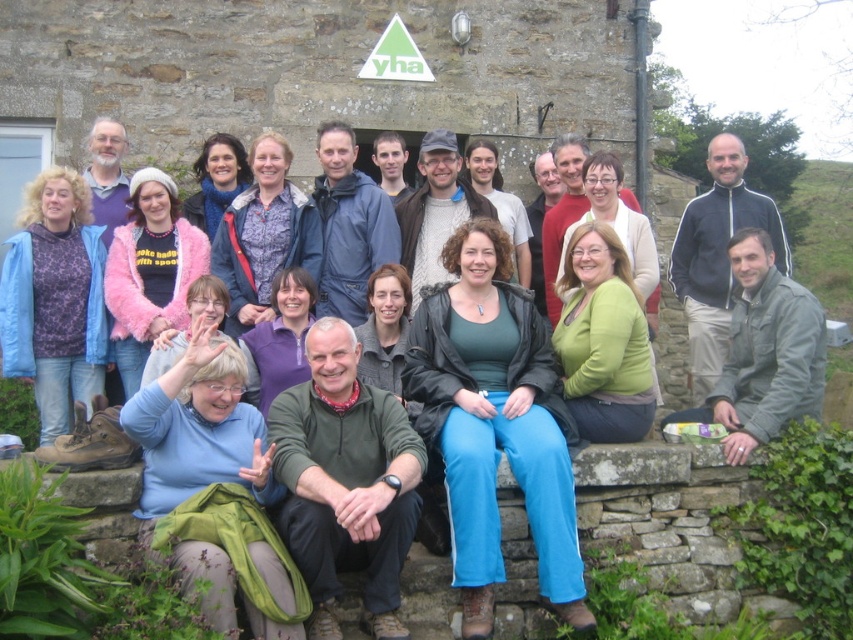
You are a photographer trying to capture a closeup of the green matte shirt at center and the knitted gray sweater at center. Which one is wider so that you can focus on it first?

The green matte shirt at center might be wider than knitted gray sweater at center, so you should focus on the green matte shirt at center first.

You are a photographer trying to focus on the matte blue scarf at center. However, the gray fabric jacket at lower right is blocking your view. Can you move the jacket to the side so you can see the scarf clearly?

The gray fabric jacket at lower right is in front of the matte blue scarf at center, so moving the jacket to the side would allow you to see the scarf clearly.